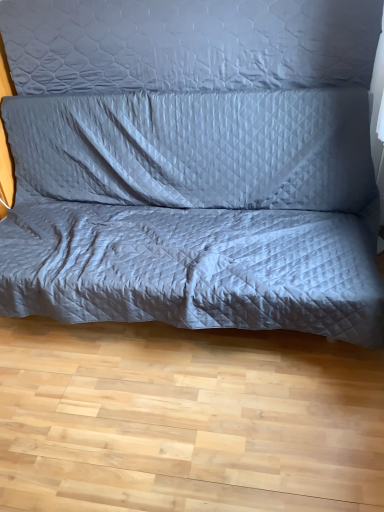
Question: From a real-world perspective, is quilted fabric couch at center beneath gray quilted pillow at upper center?

Choices:
 (A) yes
 (B) no

Answer: (A)

Question: Could gray quilted pillow at upper center be considered to be inside quilted fabric couch at center?

Choices:
 (A) no
 (B) yes

Answer: (A)

Question: Considering the relative sizes of quilted fabric couch at center and gray quilted pillow at upper center in the image provided, is quilted fabric couch at center taller than gray quilted pillow at upper center?

Choices:
 (A) no
 (B) yes

Answer: (B)

Question: From the image's perspective, is quilted fabric couch at center above gray quilted pillow at upper center?

Choices:
 (A) no
 (B) yes

Answer: (A)

Question: Is the depth of quilted fabric couch at center greater than that of gray quilted pillow at upper center?

Choices:
 (A) yes
 (B) no

Answer: (B)

Question: Is quilted fabric couch at center located outside gray quilted pillow at upper center?

Choices:
 (A) yes
 (B) no

Answer: (A)

Question: Can you confirm if gray quilted pillow at upper center is smaller than quilted fabric couch at center?

Choices:
 (A) no
 (B) yes

Answer: (B)

Question: Considering the relative positions of gray quilted pillow at upper center and quilted fabric couch at center in the image provided, is gray quilted pillow at upper center to the right of quilted fabric couch at center from the viewer's perspective?

Choices:
 (A) yes
 (B) no

Answer: (A)

Question: From a real-world perspective, is gray quilted pillow at upper center physically below quilted fabric couch at center?

Choices:
 (A) yes
 (B) no

Answer: (B)

Question: Is gray quilted pillow at upper center touching quilted fabric couch at center?

Choices:
 (A) no
 (B) yes

Answer: (A)

Question: Does gray quilted pillow at upper center have a lesser width compared to quilted fabric couch at center?

Choices:
 (A) yes
 (B) no

Answer: (A)

Question: Is gray quilted pillow at upper center not near quilted fabric couch at center?

Choices:
 (A) no
 (B) yes

Answer: (A)

Question: From a real-world perspective, relative to gray quilted pillow at upper center, is quilted fabric couch at center vertically above or below?

Choices:
 (A) below
 (B) above

Answer: (A)